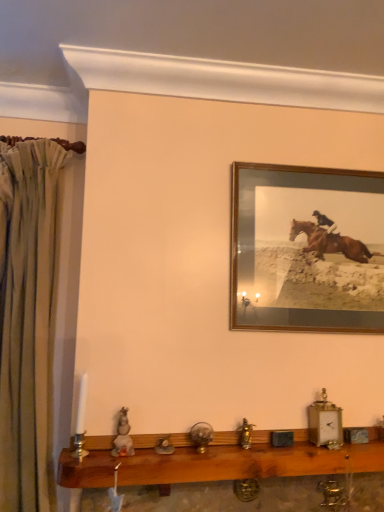
Question: From the image's perspective, is beige fabric curtain at left on wooden frame at upper right?

Choices:
 (A) yes
 (B) no

Answer: (B)

Question: Can you confirm if beige fabric curtain at left is shorter than wooden frame at upper right?

Choices:
 (A) no
 (B) yes

Answer: (A)

Question: From the image's perspective, is beige fabric curtain at left under wooden frame at upper right?

Choices:
 (A) yes
 (B) no

Answer: (A)

Question: Can you confirm if beige fabric curtain at left is thinner than wooden frame at upper right?

Choices:
 (A) yes
 (B) no

Answer: (B)

Question: Is the position of beige fabric curtain at left more distant than that of wooden frame at upper right?

Choices:
 (A) yes
 (B) no

Answer: (B)

Question: Visually, is wooden frame at upper right positioned to the left or to the right of beige fabric curtain at left?

Choices:
 (A) left
 (B) right

Answer: (B)

Question: From a real-world perspective, is wooden frame at upper right positioned above or below beige fabric curtain at left?

Choices:
 (A) above
 (B) below

Answer: (A)

Question: Relative to beige fabric curtain at left, is wooden frame at upper right in front or behind?

Choices:
 (A) front
 (B) behind

Answer: (B)

Question: Looking at their shapes, would you say wooden frame at upper right is wider or thinner than beige fabric curtain at left?

Choices:
 (A) thin
 (B) wide

Answer: (A)

Question: Is wooden shelf at lower center taller or shorter than beige fabric curtain at left?

Choices:
 (A) tall
 (B) short

Answer: (B)

Question: Does point (311, 458) appear closer or farther from the camera than point (44, 346)?

Choices:
 (A) closer
 (B) farther

Answer: (A)

Question: From a real-world perspective, is wooden shelf at lower center physically located above or below beige fabric curtain at left?

Choices:
 (A) below
 (B) above

Answer: (A)

Question: From the image's perspective, relative to beige fabric curtain at left, is wooden shelf at lower center above or below?

Choices:
 (A) below
 (B) above

Answer: (A)

Question: From the image's perspective, is wooden shelf at lower center positioned above or below wooden frame at upper right?

Choices:
 (A) below
 (B) above

Answer: (A)

Question: Is wooden shelf at lower center wider or thinner than wooden frame at upper right?

Choices:
 (A) thin
 (B) wide

Answer: (B)